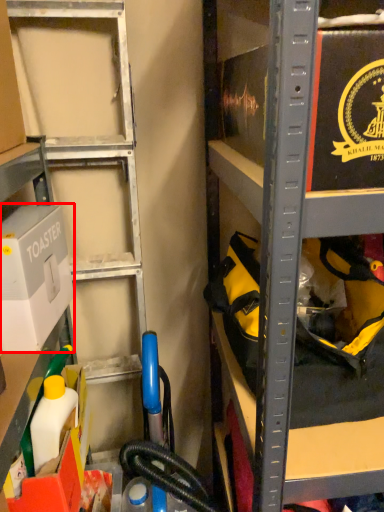
Question: From the image's perspective, where is box (annotated by the red box) located relative to box?

Choices:
 (A) above
 (B) below

Answer: (A)